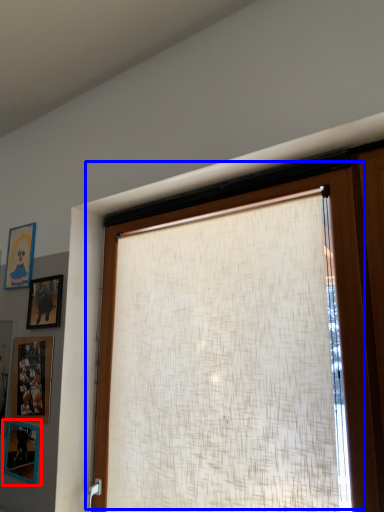
Question: Which object appears farthest to the camera in this image, picture frame (highlighted by a red box) or window (highlighted by a blue box)?

Choices:
 (A) picture frame
 (B) window

Answer: (A)